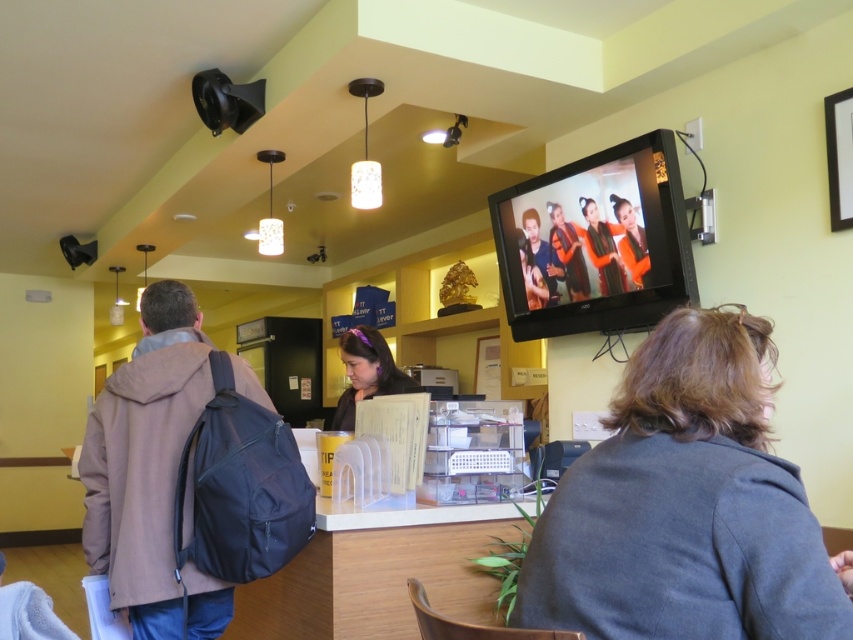
Can you confirm if brown fabric backpack at left is shorter than matte purple hairband at center?

Incorrect, brown fabric backpack at left's height does not fall short of matte purple hairband at center's.

Is point (120, 508) more distant than point (337, 422)?

No, (120, 508) is closer to viewer.

Identify the location of brown fabric backpack at left. (144, 460).

This screenshot has width=853, height=640. What are the coordinates of `matte orange dress at upper center` in the screenshot? It's located at 602,248.

Which is more to the left, matte orange dress at upper center or orange fabric woman at upper center?

matte orange dress at upper center

Is point (616, 227) positioned after point (642, 278)?

Yes, point (616, 227) is behind point (642, 278).

Image resolution: width=853 pixels, height=640 pixels. What are the coordinates of `matte orange dress at upper center` in the screenshot? It's located at (602, 248).

Can you confirm if brown fabric backpack at left is positioned above orange fabric woman at upper center?

No.

Does point (84, 458) come behind point (643, 230)?

No, (84, 458) is closer to viewer.

Measure the distance between brown fabric backpack at left and camera.

brown fabric backpack at left is 1.85 meters away from camera.

This screenshot has width=853, height=640. I want to click on brown fabric backpack at left, so click(x=144, y=460).